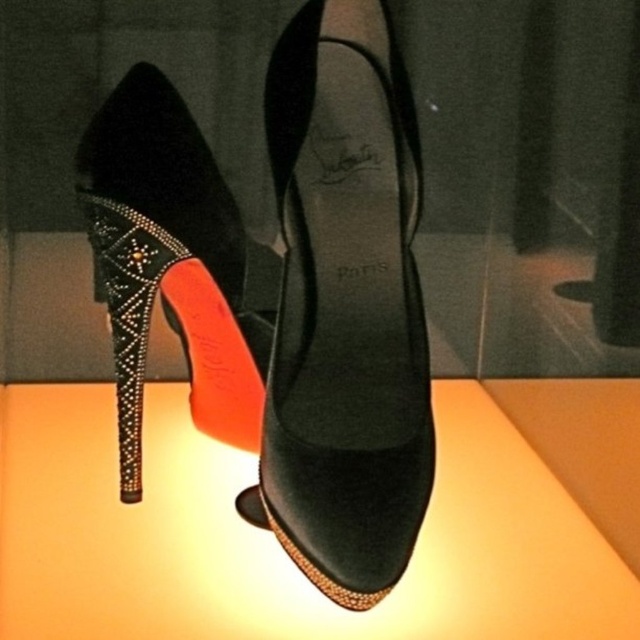
Question: Does velvet high-heeled shoe at center have a lesser width compared to satin black shoe at center?

Choices:
 (A) no
 (B) yes

Answer: (A)

Question: Among these points, which one is nearest to the camera?

Choices:
 (A) (417, 460)
 (B) (221, 385)

Answer: (A)

Question: Can you confirm if velvet high-heeled shoe at center is positioned to the right of satin black shoe at center?

Choices:
 (A) no
 (B) yes

Answer: (B)

Question: Which point is farther to the camera?

Choices:
 (A) velvet high-heeled shoe at center
 (B) satin black shoe at center

Answer: (B)

Question: Can you confirm if velvet high-heeled shoe at center is positioned below satin black shoe at center?

Choices:
 (A) no
 (B) yes

Answer: (B)